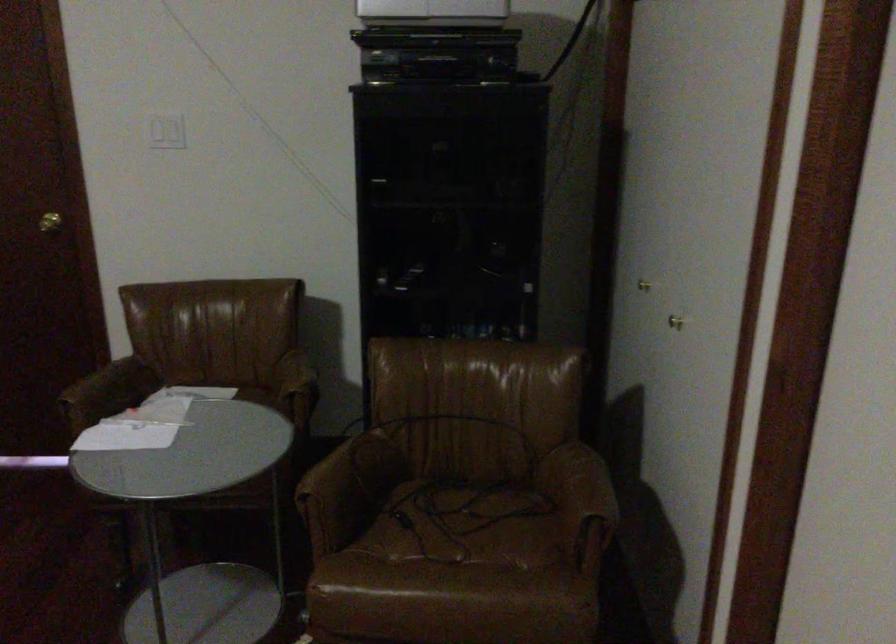
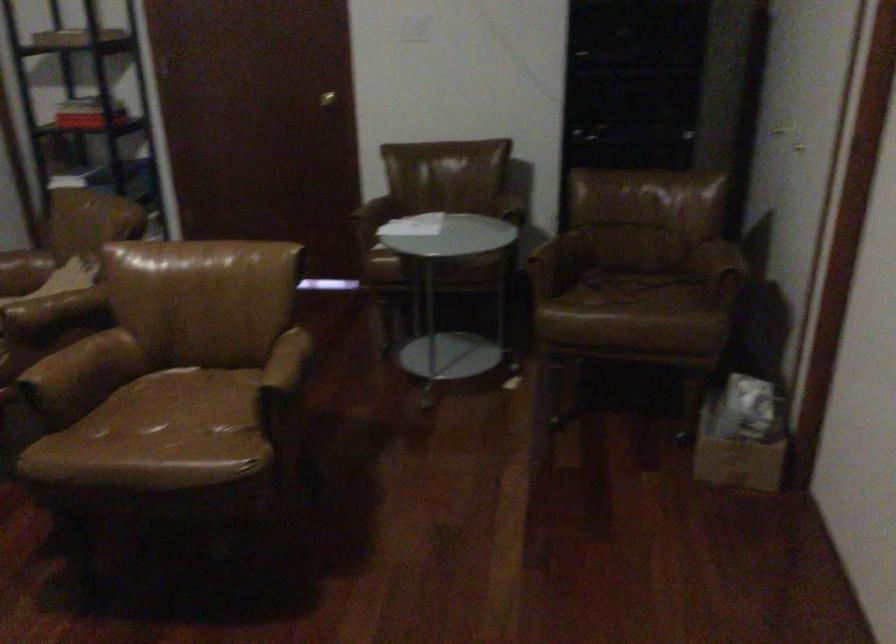
Question: The images are taken continuously from a first-person perspective. In which direction are you moving?

Choices:
 (A) Left
 (B) Right
 (C) Forward
 (D) Backward

Answer: (D)